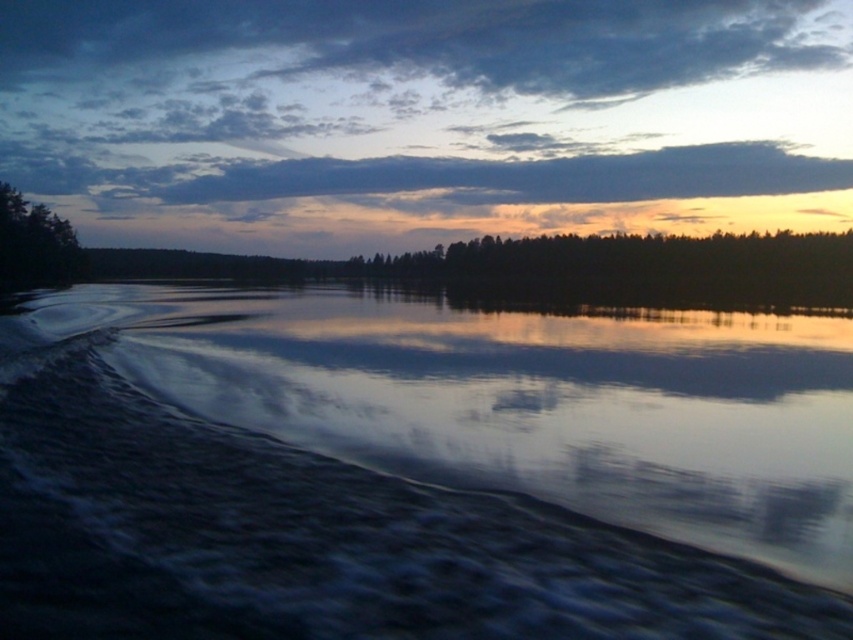
Can you confirm if green matte trees at center is positioned to the left of green matte tree at left?

No, green matte trees at center is not to the left of green matte tree at left.

Is green matte trees at center above green matte tree at left?

No, green matte trees at center is not above green matte tree at left.

In order to click on green matte trees at center in this screenshot , I will do `click(637, 266)`.

Can you confirm if dark reflective water at lower left is taller than green matte tree at left?

In fact, dark reflective water at lower left may be shorter than green matte tree at left.

Where is `dark reflective water at lower left`? The image size is (853, 640). dark reflective water at lower left is located at coordinates (418, 467).

Locate an element on the screen. This screenshot has width=853, height=640. dark reflective water at lower left is located at coordinates (418, 467).

Is point (550, 608) positioned behind point (651, 256)?

No.

This screenshot has height=640, width=853. Describe the element at coordinates (418, 467) in the screenshot. I see `dark reflective water at lower left` at that location.

Between point (773, 481) and point (396, 273), which one is positioned behind?

Positioned behind is point (396, 273).

Where is `dark reflective water at lower left`? dark reflective water at lower left is located at coordinates (418, 467).